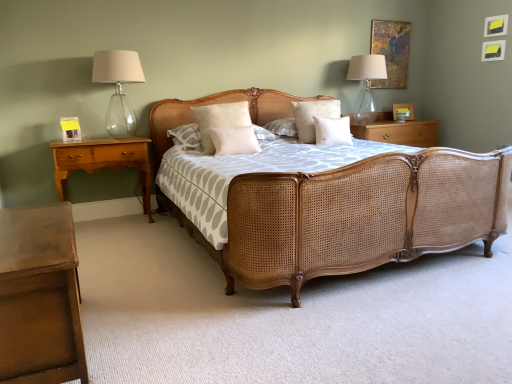
Question: Looking at their shapes, would you say wooden picture frame at upper right, which ranks as the first picture frame in top-to-bottom order, is wider or thinner than transparent glass lampshade at upper right, the first bedside lamp positioned from the right?

Choices:
 (A) thin
 (B) wide

Answer: (A)

Question: Is wooden picture frame at upper right, the 1th picture frame viewed from the back, taller or shorter than transparent glass lampshade at upper right, which is the 2th bedside lamp from front to back?

Choices:
 (A) short
 (B) tall

Answer: (B)

Question: Which object is the farthest from the white soft pillow at center, which is counted as the 3th pillow, starting from the right?

Choices:
 (A) wooden picture frame at upper right, the 2th picture frame from the bottom
 (B) light brown wood nightstand at left, which is the third nightstand from right to left
 (C) wooden nightstand at right, placed as the 3th nightstand when sorted from left to right
 (D) transparent glass lampshade at upper right, which is the 2th bedside lamp from left to right
 (E) matte yellow picture frame at left, positioned as the 1th picture frame in bottom-to-top order

Answer: (A)

Question: Estimate the real-world distances between objects in this image. Which object is closer to the wooden nightstand at right, placed as the first nightstand when sorted from back to front?

Choices:
 (A) clear glass lampshade at left, arranged as the 2th bedside lamp when viewed from the back
 (B) wooden picture frame at upper right, the 2th picture frame from the bottom
 (C) wooden nightstand at lower left, acting as the third nightstand starting from the back
 (D) beige cotton pillow at center, marked as the 3th pillow in a left-to-right arrangement
 (E) white soft pillow at center, placed as the 1th pillow when sorted from left to right

Answer: (B)